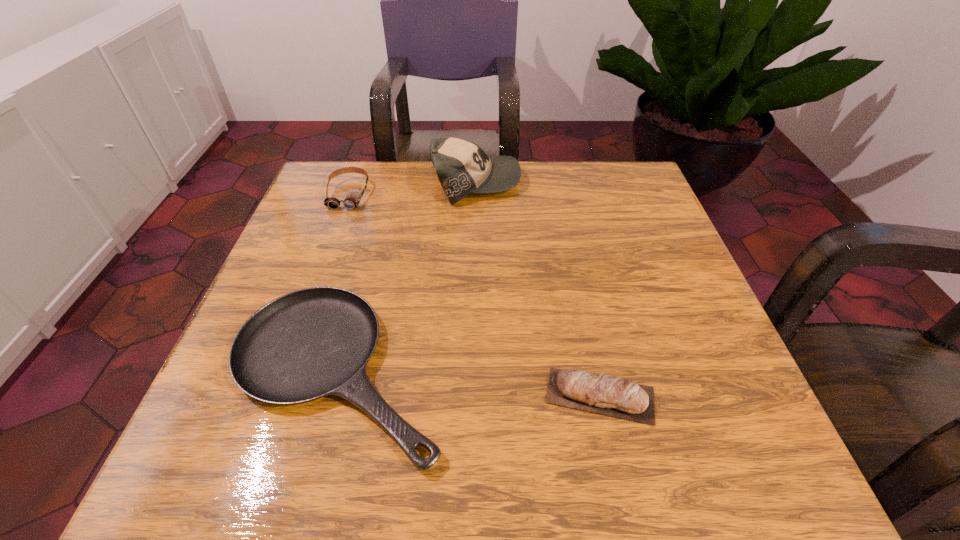
Image resolution: width=960 pixels, height=540 pixels. I want to click on vacant position in the image that satisfies the following two spatial constraints: 1. on the front-facing side of the rightmost object; 2. on the right side of the goggles, so click(275, 395).

This screenshot has height=540, width=960. I want to click on vacant region that satisfies the following two spatial constraints: 1. on the front-facing side of the pita bread; 2. on the left side of the goggles, so (275, 395).